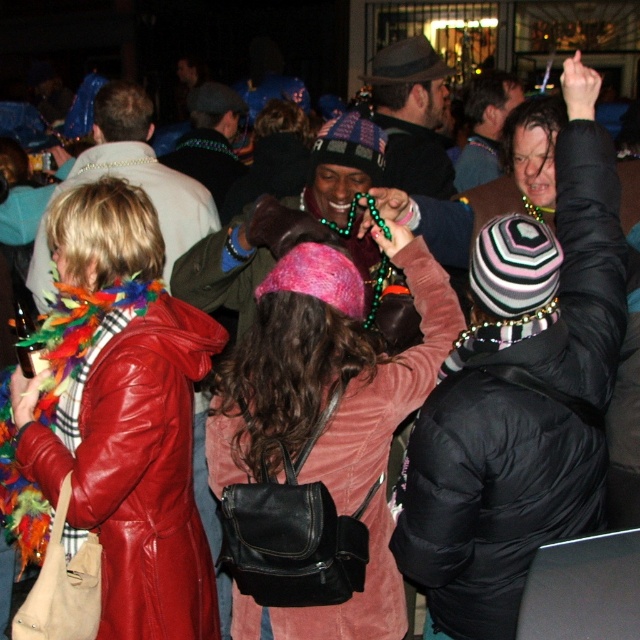
Based on the scene description, where is the leather jacket at center located in terms of its 2D coordinates?

The leather jacket at center is located at the 2D coordinates point (x=109, y=429).